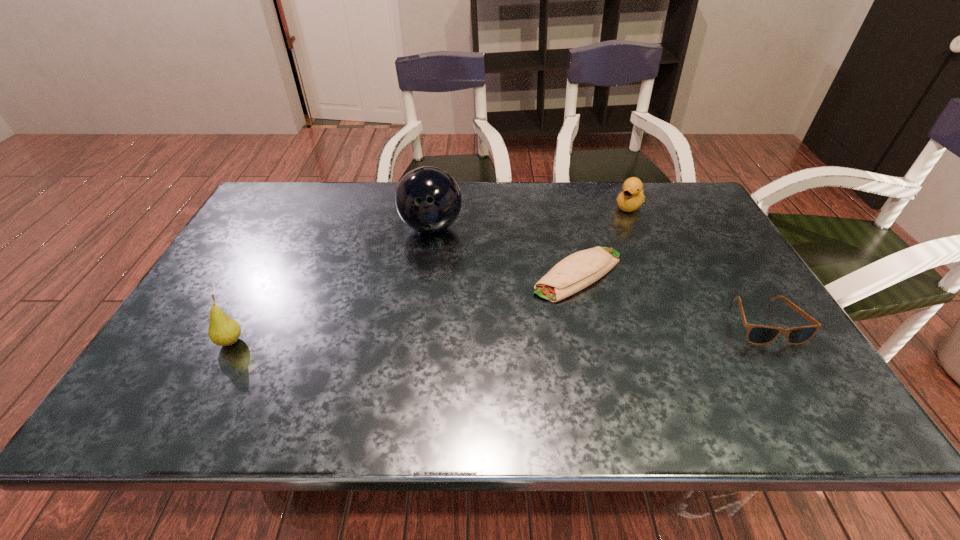
Locate an element on the screen. The image size is (960, 540). free spot on the desktop that is between the fourth shortest object and the sunglasses and is positioned on the side of the tallest object with the finger holes is located at coordinates (446, 334).

Where is `vacant space on the desktop that is between the leftmost object and the second shortest object and is positioned facing forward on the third tallest object`? Image resolution: width=960 pixels, height=540 pixels. vacant space on the desktop that is between the leftmost object and the second shortest object and is positioned facing forward on the third tallest object is located at coordinates (530, 331).

Where is `free spot on the desktop that is between the leftmost object and the sunglasses and is positioned at the bitten end of the burrito`? free spot on the desktop that is between the leftmost object and the sunglasses and is positioned at the bitten end of the burrito is located at coordinates (484, 333).